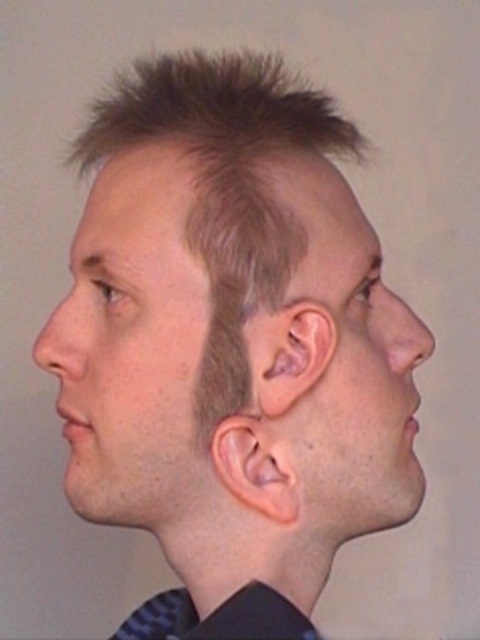
Does point (303, 305) lie behind point (273, 476)?

No, (303, 305) is closer to viewer.

Which is above, pinkish matte ear at center or pinkish flesh-colored ear at center?

pinkish matte ear at center is above.

The width and height of the screenshot is (480, 640). What do you see at coordinates (288, 353) in the screenshot?
I see `pinkish matte ear at center` at bounding box center [288, 353].

Locate an element on the screen. This screenshot has width=480, height=640. pinkish matte ear at center is located at coordinates (288, 353).